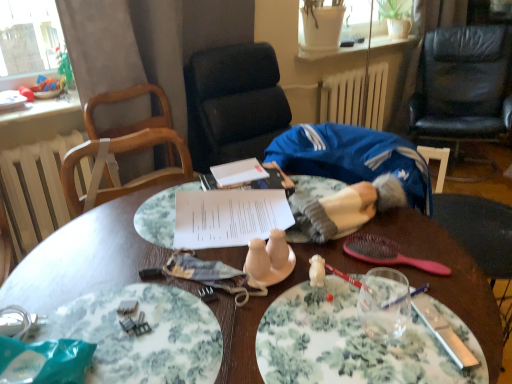
Identify the location of empty space that is ontop of floral-patterned plate at lower left, which is counted as the 2th plate, starting from the right (from a real-world perspective). (130, 334).